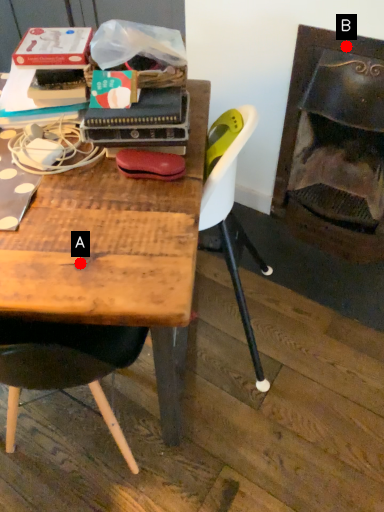
Question: Two points are circled on the image, labeled by A and B beside each circle. Which point is closer to the camera taking this photo?

Choices:
 (A) A is closer
 (B) B is closer

Answer: (A)